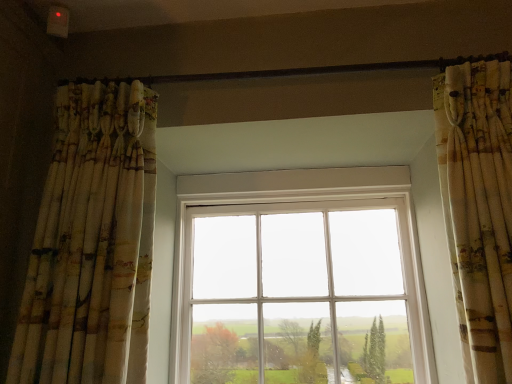
Describe the element at coordinates (92, 243) in the screenshot. I see `floral fabric curtain at left` at that location.

Identify the location of floral fabric curtain at left. Image resolution: width=512 pixels, height=384 pixels. (92, 243).

In order to face floral fabric curtain at left, should I rotate leftwards or rightwards?

Rotate your view left by about 24.810°.

I want to click on floral fabric curtain at left, so click(x=92, y=243).